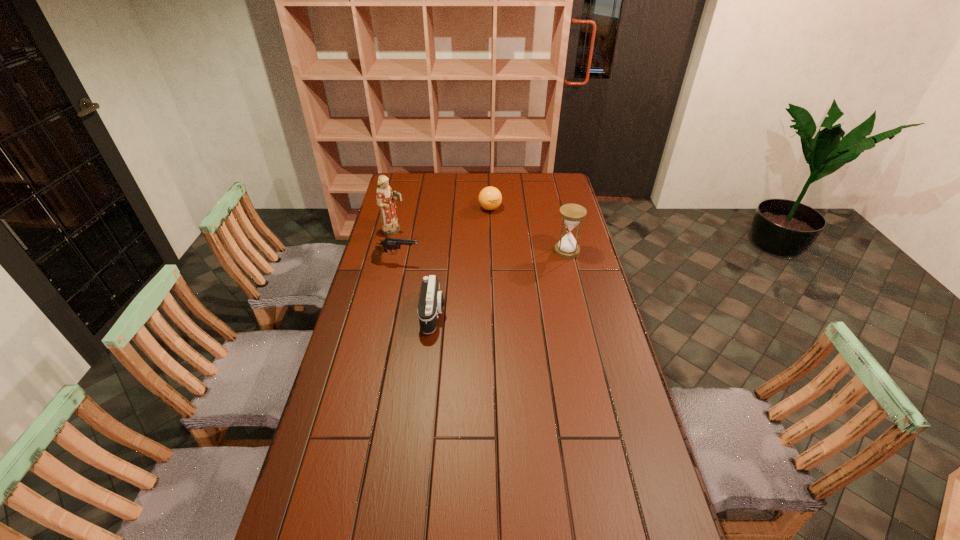
Where is `free space on the desktop that is between the nearest object and the hourglass and is positioned along the barrel of the gun`? free space on the desktop that is between the nearest object and the hourglass and is positioned along the barrel of the gun is located at coordinates (522, 272).

I want to click on vacant spot on the desktop that is between the nearest object and the hourglass and is positioned on the front-facing side of the tallest object, so click(512, 277).

This screenshot has height=540, width=960. Identify the location of vacant spot on the desktop that is between the camera and the fourth shortest object and is positioned on the side with brand of the farthest object. (494, 285).